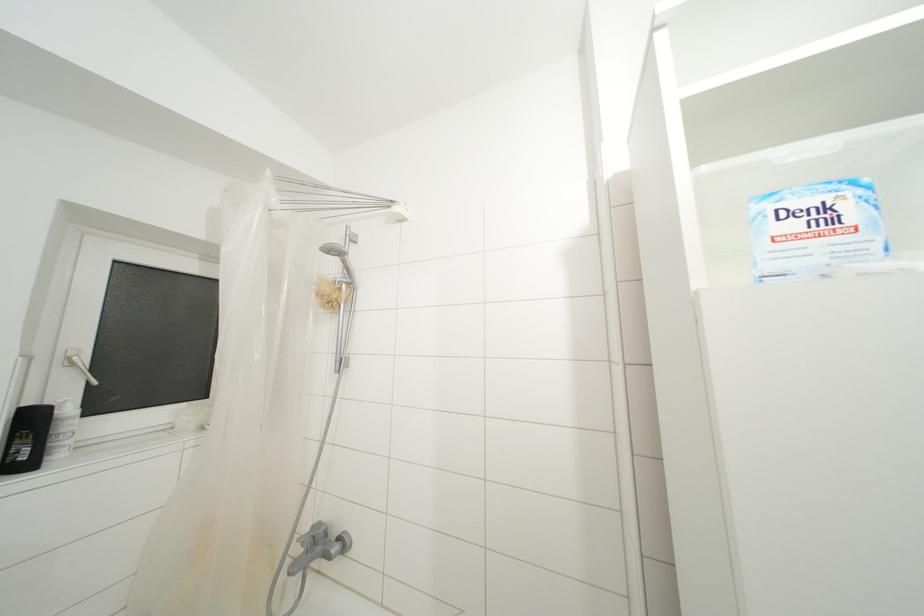
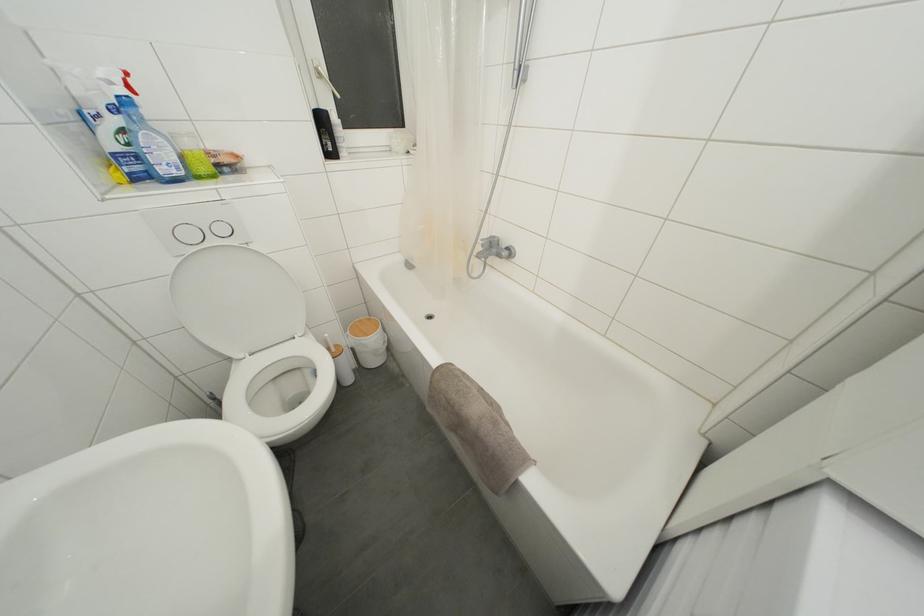
The point at (35, 424) is marked in the first image. Where is the corresponding point in the second image?

(325, 126)